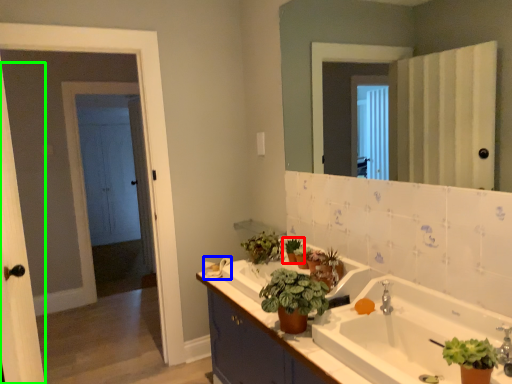
Question: Estimate the real-world distances between objects in this image. Which object is farther from houseplant (highlighted by a red box), towel bar (highlighted by a blue box) or screen door (highlighted by a green box)?

Choices:
 (A) towel bar
 (B) screen door

Answer: (B)